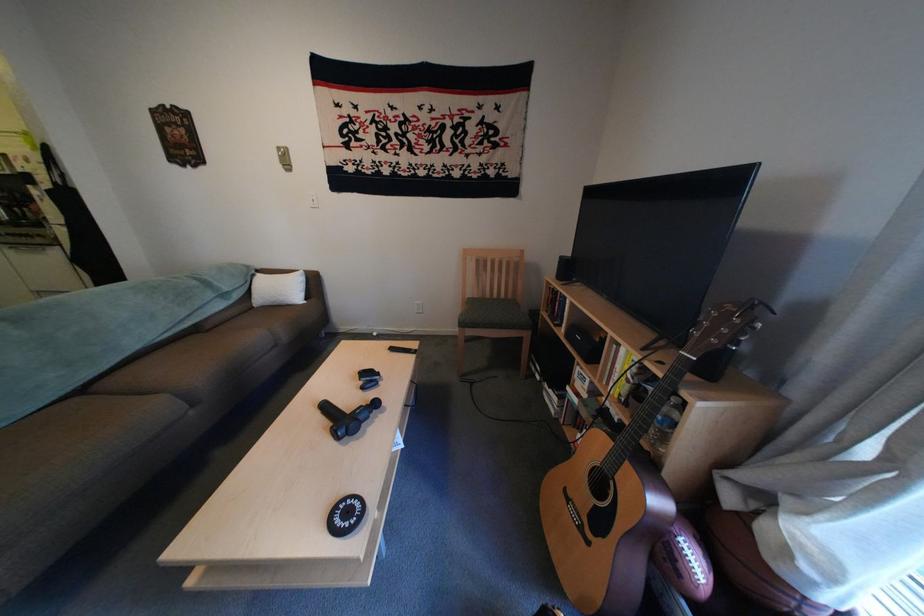
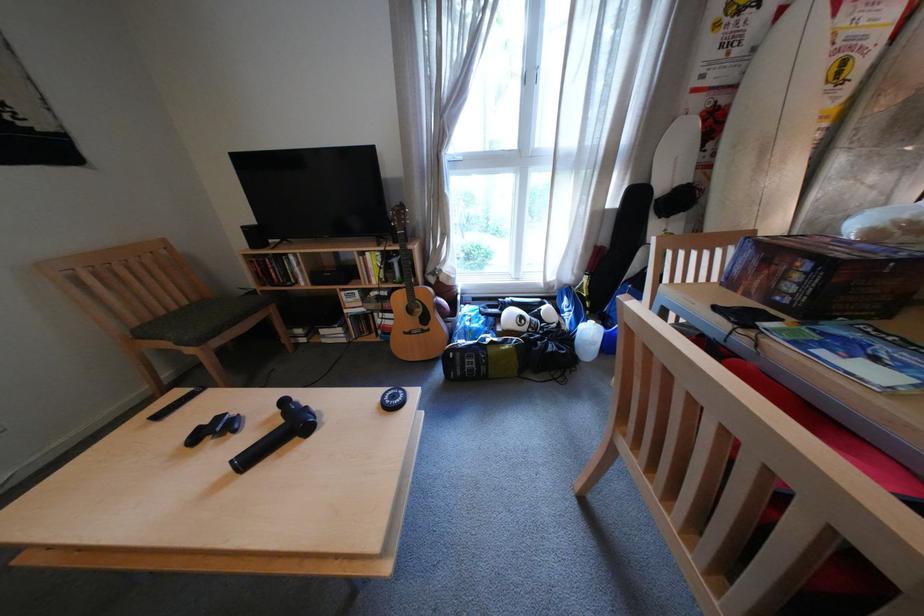
Where in the second image is the point corresponding to (517,297) from the first image?

(199, 304)